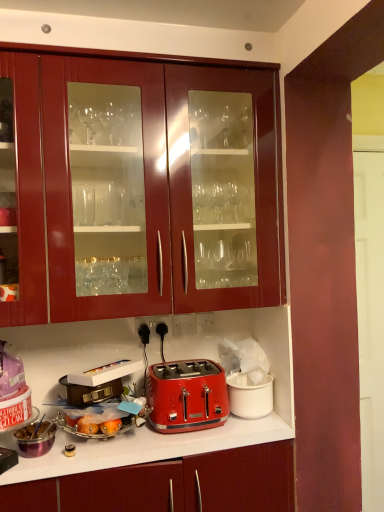
Identify the location of blank space situated above red metallic toaster at center (from a real-world perspective). The width and height of the screenshot is (384, 512). (188, 367).